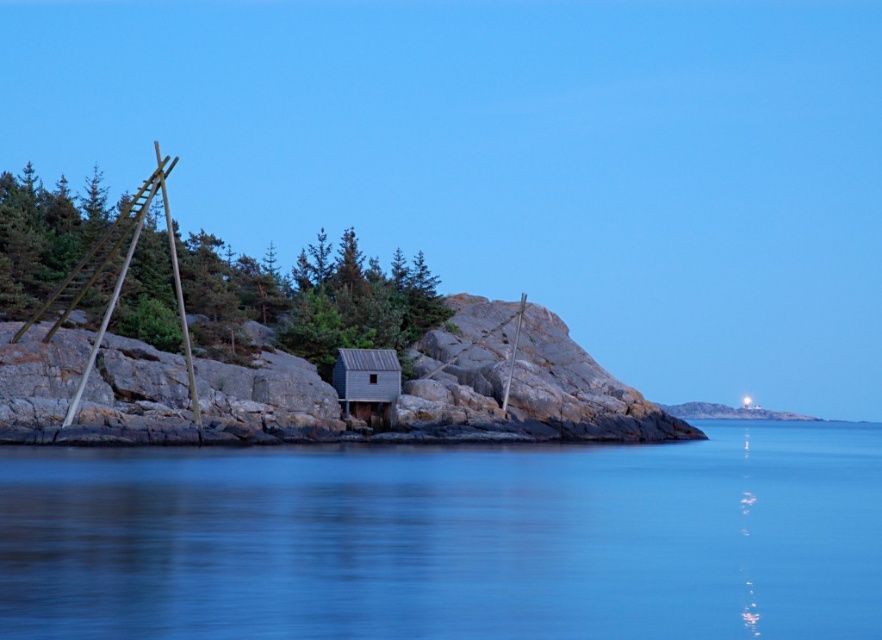
Is point (412, 586) closer to camera compared to point (349, 362)?

Yes, it is in front of point (349, 362).

Based on the photo, can you confirm if blue smooth water at center is wider than wooden cabin at center?

Indeed, blue smooth water at center has a greater width compared to wooden cabin at center.

Describe the element at coordinates (450, 540) in the screenshot. I see `blue smooth water at center` at that location.

At what (x,y) coordinates should I click in order to perform the action: click on blue smooth water at center. Please return your answer as a coordinate pair (x, y). This screenshot has height=640, width=882. Looking at the image, I should click on (450, 540).